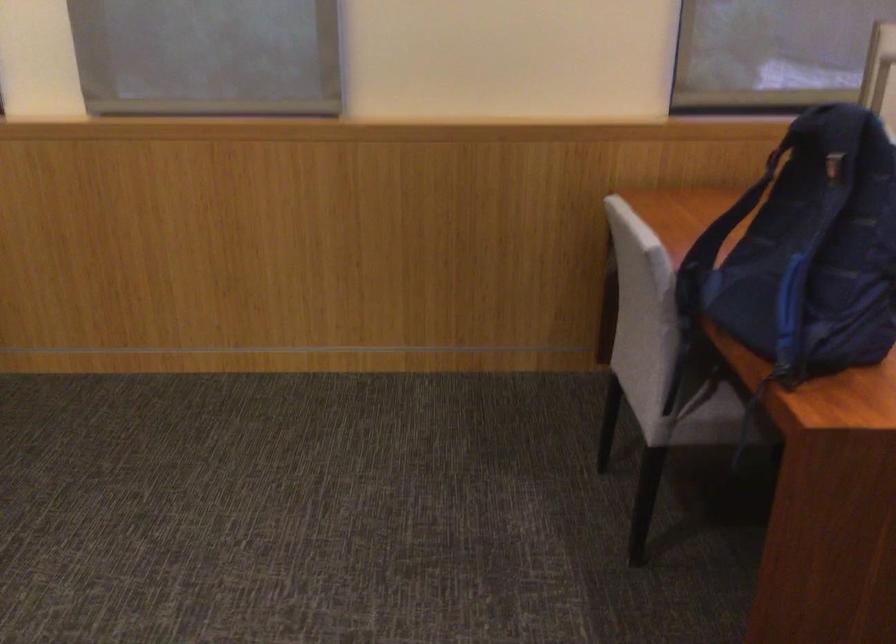
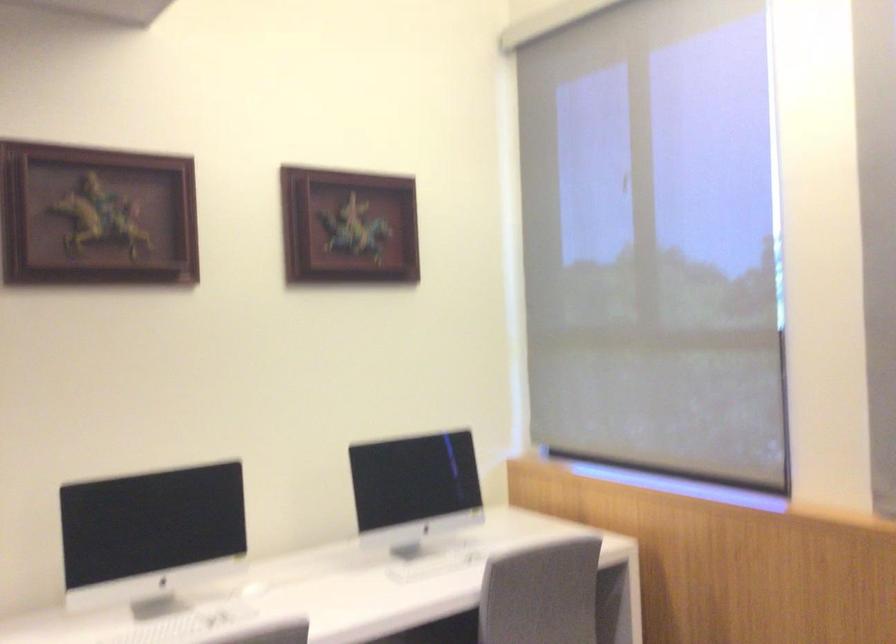
Question: The camera is either moving clockwise (left) or counter-clockwise (right) around the object. The first image is from the beginning of the video and the second image is from the end. Is the camera moving left or right when shooting the video?

Choices:
 (A) Left
 (B) Right

Answer: (B)